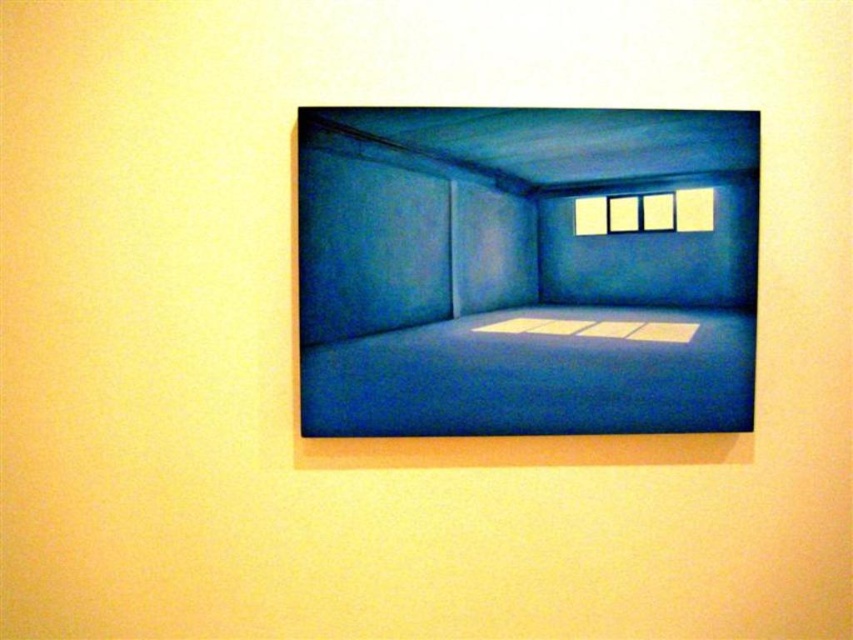
You are standing in the minimalist room with a deep blue color scheme. You see two points marked on the wall in front of you. The first point is at coordinates point (735, 170) and the second point is at point (712, 205). If you were to reach out and touch both points, which one would require you to extend your arm less to touch?

Point (735, 170) is closer to the camera than point (712, 205), so you would need to extend your arm less to touch point (735, 170).

You are an interior designer assessing the space in the image. You need to place a large rectangular piece of furniture that requires a minimum width of 2 meters. Based on the blue matte room at center and the white matte window at upper center, which area would you consider for placement and why?

The blue matte room at center might be wider than the white matte window at upper center, so the blue matte room at center is a better option for placing the large furniture as it likely has sufficient width to accommodate the required 2 meters.

You are standing in front of the photograph of the room. You notice the blue matte room at center and the white matte window at upper center. Which object is nearer to you in the image?

The blue matte room at center is closer to the viewer than the white matte window at upper center, so the blue matte room at center is nearer to you.